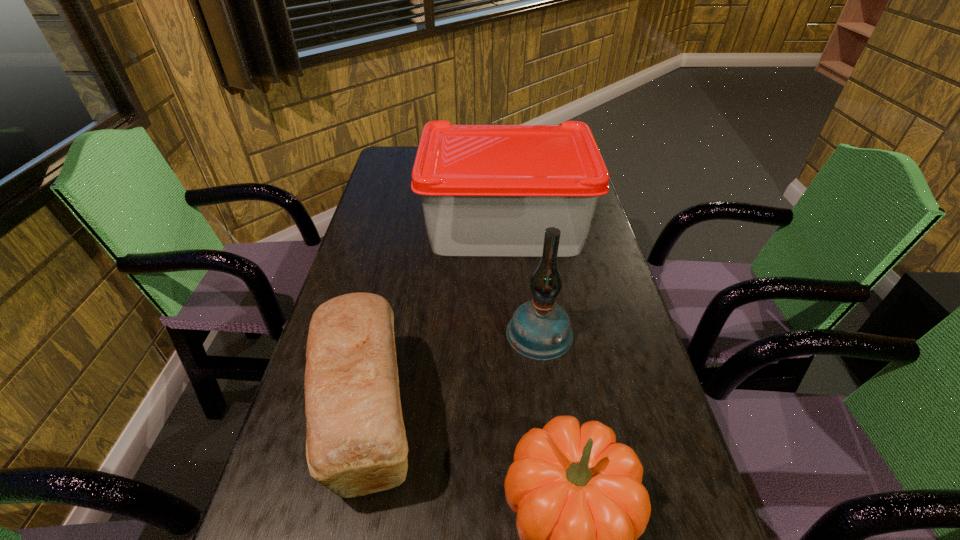
This screenshot has width=960, height=540. I want to click on free location at the right edge of the desktop, so [658, 441].

Find the location of a particular element. Image resolution: width=960 pixels, height=540 pixels. vacant region at the far left corner is located at coordinates (413, 148).

Find the location of a particular element. This screenshot has height=540, width=960. free space between the farthest object and the oil lamp is located at coordinates (522, 279).

Image resolution: width=960 pixels, height=540 pixels. Find the location of `free space between the oil lamp and the farthest object`. free space between the oil lamp and the farthest object is located at coordinates click(522, 279).

What are the coordinates of `empty location between the oil lamp and the tray` in the screenshot? It's located at click(522, 279).

What are the coordinates of `free space between the bread and the tray` in the screenshot? It's located at 437,321.

Locate which object ranks in proximity to the pumpkin. Please provide its 2D coordinates. Your answer should be formatted as a tuple, i.e. [(x, y)], where the tuple contains the x and y coordinates of a point satisfying the conditions above.

[(356, 444)]

Locate an element on the screen. Image resolution: width=960 pixels, height=540 pixels. object that stands as the third closest to the bread is located at coordinates (487, 190).